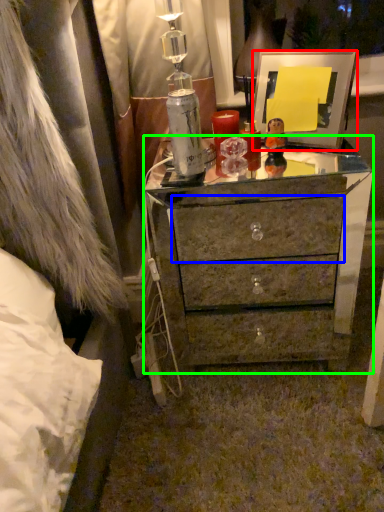
Question: Considering the real-world distances, which object is farthest from picture frame (highlighted by a red box)? drawer (highlighted by a blue box) or chest of drawers (highlighted by a green box)?

Choices:
 (A) drawer
 (B) chest of drawers

Answer: (A)